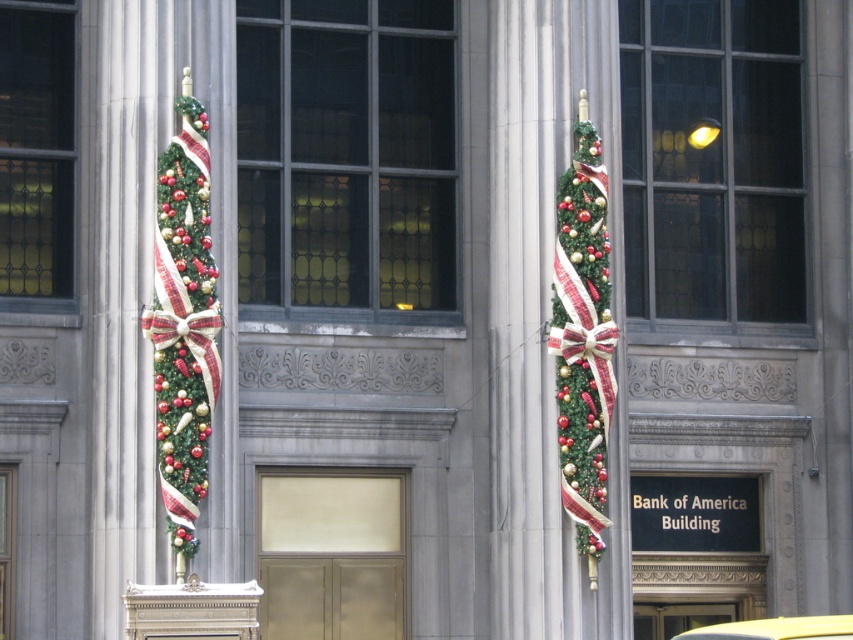
Question: Does green textured wreath at left appear under green textured christmas tree at right?

Choices:
 (A) yes
 (B) no

Answer: (A)

Question: Among these points, which one is farthest from the camera?

Choices:
 (A) (573, 404)
 (B) (836, 628)

Answer: (A)

Question: Can you confirm if green textured christmas tree at right is positioned above yellow matte car at center?

Choices:
 (A) yes
 (B) no

Answer: (A)

Question: Which point is closer to the camera taking this photo?

Choices:
 (A) (688, 634)
 (B) (195, 333)

Answer: (B)

Question: Is green textured wreath at left above yellow matte car at center?

Choices:
 (A) yes
 (B) no

Answer: (A)

Question: Which of the following is the closest to the observer?

Choices:
 (A) (602, 500)
 (B) (805, 620)

Answer: (B)